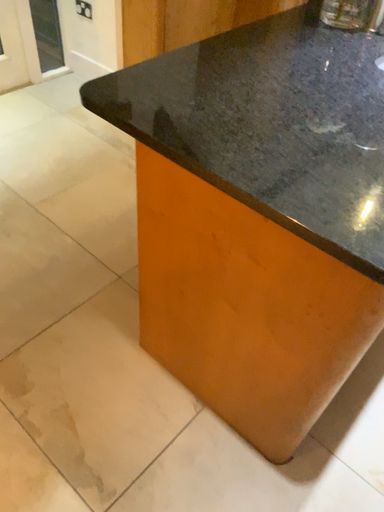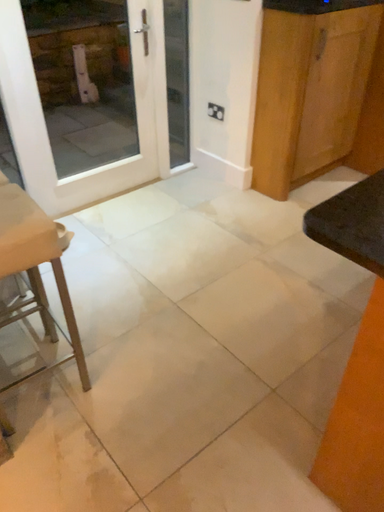
Question: How did the camera likely rotate when shooting the video?

Choices:
 (A) rotated upward
 (B) rotated downward

Answer: (A)